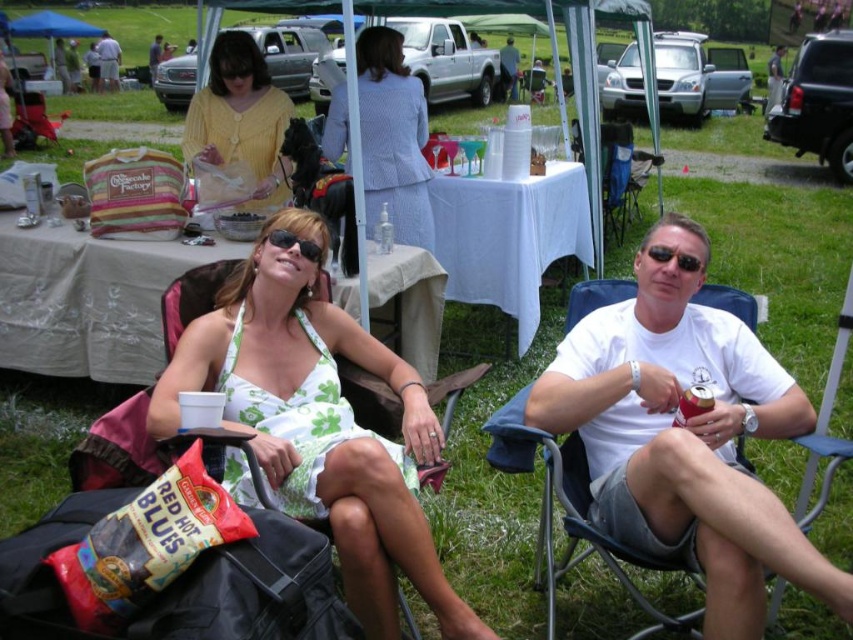
Who is lower down, white cotton t-shirt at center or light blue textured suit at center?

white cotton t-shirt at center is below.

Is point (811, 572) behind point (326, 141)?

No, it is not.

This screenshot has width=853, height=640. Describe the element at coordinates (685, 435) in the screenshot. I see `white cotton t-shirt at center` at that location.

In order to click on white cotton t-shirt at center in this screenshot , I will do `click(685, 435)`.

Does white cotton t-shirt at center have a larger size compared to yellow knit sweater at upper left?

Yes.

In the scene shown: Who is taller, white cotton t-shirt at center or yellow knit sweater at upper left?

yellow knit sweater at upper left

I want to click on white cotton t-shirt at center, so click(x=685, y=435).

Where is `white cotton t-shirt at center`? This screenshot has height=640, width=853. white cotton t-shirt at center is located at coordinates (685, 435).

Based on the photo, does white floral dress at center appear over yellow knit sweater at upper left?

No, white floral dress at center is not above yellow knit sweater at upper left.

Is white floral dress at center to the right of yellow knit sweater at upper left from the viewer's perspective?

Yes, white floral dress at center is to the right of yellow knit sweater at upper left.

Who is more distant from viewer, (427, 573) or (268, 125)?

Point (268, 125)

Identify the location of white floral dress at center. (318, 420).